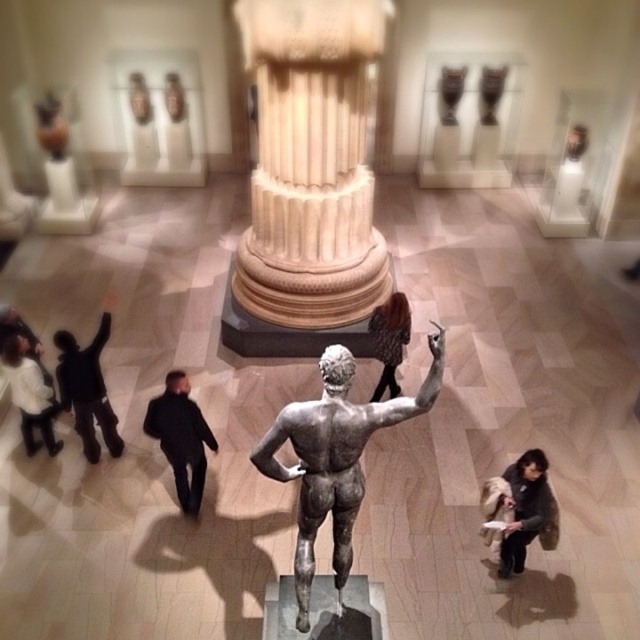
Question: Considering the relative positions of white marble column at center and dark brown fur coat at lower right in the image provided, where is white marble column at center located with respect to dark brown fur coat at lower right?

Choices:
 (A) left
 (B) right

Answer: (A)

Question: In this image, where is white marble column at center located relative to dark brown fur coat at lower right?

Choices:
 (A) below
 (B) above

Answer: (B)

Question: Which point is farther from the camera taking this photo?

Choices:
 (A) (93, 381)
 (B) (524, 538)

Answer: (A)

Question: Can you confirm if white marble column at center is bigger than black matte jacket at lower center?

Choices:
 (A) no
 (B) yes

Answer: (B)

Question: Which point is farther from the camera taking this photo?

Choices:
 (A) (541, 540)
 (B) (273, 280)

Answer: (B)

Question: Which of the following is the closest to the observer?

Choices:
 (A) (147, 422)
 (B) (296, 561)
 (C) (337, 182)

Answer: (B)